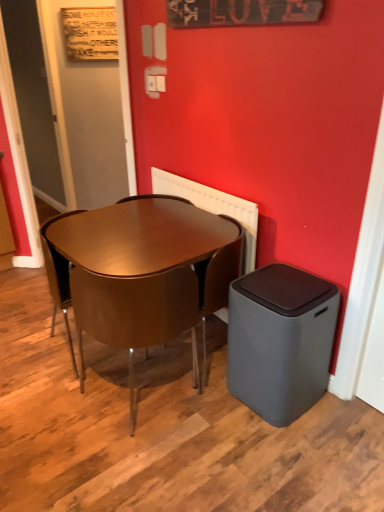
I want to click on free location in front of gray matte trash bin at lower right, so click(296, 452).